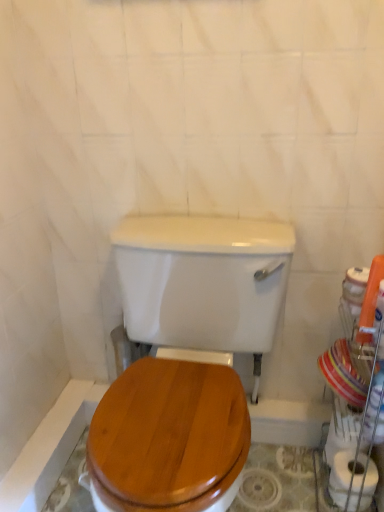
Question: Is white glossy porcelain at right closer to the viewer compared to white matte toilet paper at lower right?

Choices:
 (A) yes
 (B) no

Answer: (A)

Question: Considering the relative sizes of white glossy porcelain at right and white matte toilet paper at lower right in the image provided, is white glossy porcelain at right wider than white matte toilet paper at lower right?

Choices:
 (A) no
 (B) yes

Answer: (B)

Question: Is the position of white glossy porcelain at right more distant than that of white matte toilet paper at lower right?

Choices:
 (A) yes
 (B) no

Answer: (B)

Question: Can you confirm if white glossy porcelain at right is positioned to the left of white matte toilet paper at lower right?

Choices:
 (A) no
 (B) yes

Answer: (B)

Question: Is white glossy porcelain at right outside of white matte toilet paper at lower right?

Choices:
 (A) no
 (B) yes

Answer: (B)

Question: Considering the relative sizes of white glossy porcelain at right and white matte toilet paper at lower right in the image provided, is white glossy porcelain at right shorter than white matte toilet paper at lower right?

Choices:
 (A) yes
 (B) no

Answer: (B)

Question: Can wooden toilet seat at center be found inside white glossy porcelain at right?

Choices:
 (A) no
 (B) yes

Answer: (A)

Question: Considering the relative sizes of white glossy porcelain at right and wooden toilet seat at center in the image provided, is white glossy porcelain at right shorter than wooden toilet seat at center?

Choices:
 (A) no
 (B) yes

Answer: (B)

Question: Considering the relative positions of white glossy porcelain at right and wooden toilet seat at center in the image provided, is white glossy porcelain at right to the right of wooden toilet seat at center from the viewer's perspective?

Choices:
 (A) no
 (B) yes

Answer: (B)

Question: Can you confirm if white glossy porcelain at right is wider than wooden toilet seat at center?

Choices:
 (A) yes
 (B) no

Answer: (B)

Question: Is white glossy porcelain at right next to wooden toilet seat at center?

Choices:
 (A) no
 (B) yes

Answer: (A)

Question: From a real-world perspective, is white glossy porcelain at right over wooden toilet seat at center?

Choices:
 (A) no
 (B) yes

Answer: (A)

Question: From the image's perspective, does white matte toilet paper at lower right appear lower than white glossy porcelain at right?

Choices:
 (A) no
 (B) yes

Answer: (B)